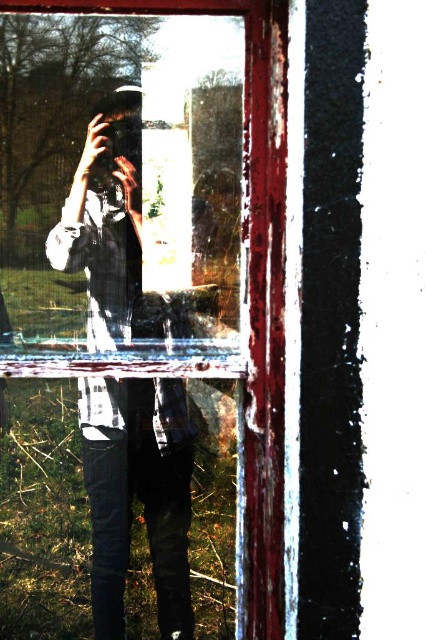
Question: Does matte black camera at center have a lesser width compared to chipped paint window frame at center?

Choices:
 (A) no
 (B) yes

Answer: (B)

Question: Observing the image, what is the correct spatial positioning of matte black camera at center in reference to chipped paint window frame at center?

Choices:
 (A) left
 (B) right

Answer: (A)

Question: Which object appears farthest from the camera in this image?

Choices:
 (A) chipped paint window frame at center
 (B) matte black camera at center

Answer: (B)

Question: Does matte black camera at center have a lesser width compared to chipped paint window frame at center?

Choices:
 (A) yes
 (B) no

Answer: (A)